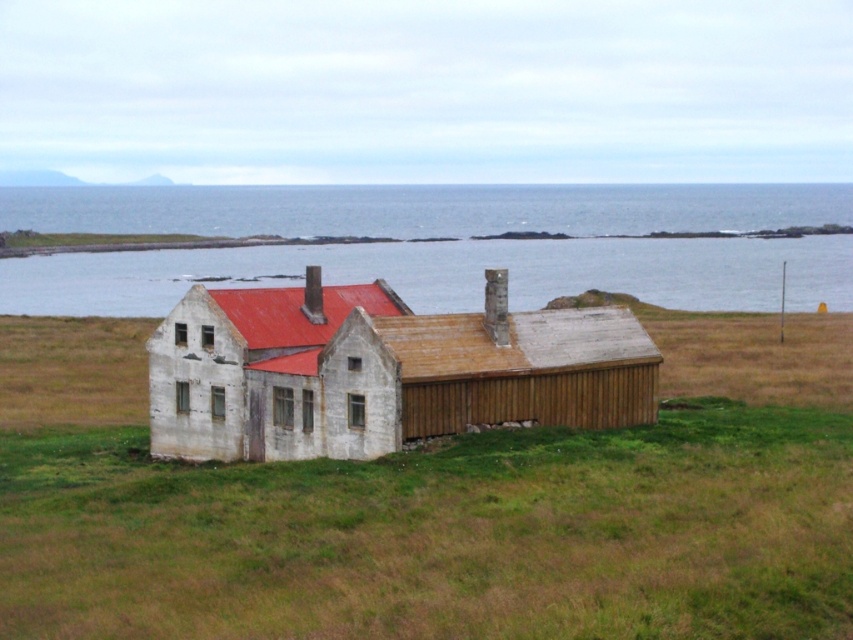
Question: Where is transparent water at center located in relation to white wooden house at center in the image?

Choices:
 (A) below
 (B) above

Answer: (B)

Question: Which point is closer to the camera?

Choices:
 (A) transparent water at center
 (B) white wooden house at center

Answer: (B)

Question: Does transparent water at center appear on the right side of white wooden house at center?

Choices:
 (A) no
 (B) yes

Answer: (B)

Question: Which of the following is the farthest from the observer?

Choices:
 (A) (560, 372)
 (B) (212, 204)

Answer: (B)

Question: Can you confirm if transparent water at center is positioned above white wooden house at center?

Choices:
 (A) yes
 (B) no

Answer: (A)

Question: Which point is closer to the camera taking this photo?

Choices:
 (A) (604, 269)
 (B) (299, 442)

Answer: (B)